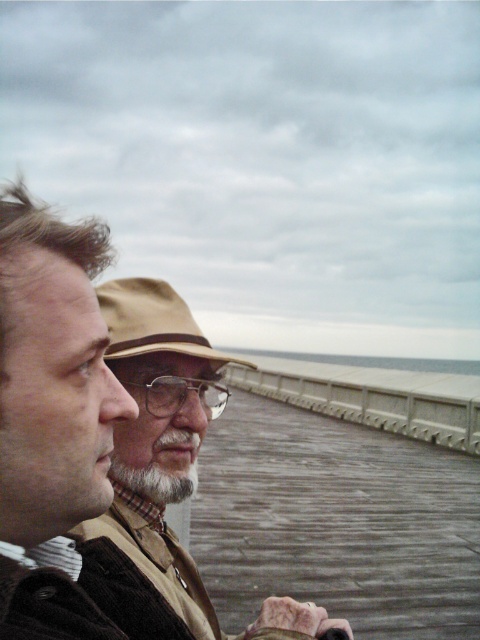
Question: Is gray concrete rail at center to the left of tan felt hat at center from the viewer's perspective?

Choices:
 (A) yes
 (B) no

Answer: (B)

Question: Where is brown woolen sweater at center located in relation to gray concrete rail at center in the image?

Choices:
 (A) right
 (B) left

Answer: (B)

Question: Considering the real-world distances, which object is closest to the gray concrete rail at center?

Choices:
 (A) graywoollybeard at center
 (B) tan felt hat at center
 (C) brown woolen sweater at center

Answer: (C)

Question: Estimate the real-world distances between objects in this image. Which object is closer to the gray concrete rail at center?

Choices:
 (A) brown woolen sweater at center
 (B) tan felt hat at center

Answer: (A)

Question: Does tan felt hat at center appear under graywoollybeard at center?

Choices:
 (A) no
 (B) yes

Answer: (A)

Question: Which object is the farthest from the tan felt hat at center?

Choices:
 (A) graywoollybeard at center
 (B) gray concrete rail at center
 (C) brown woolen sweater at center

Answer: (B)